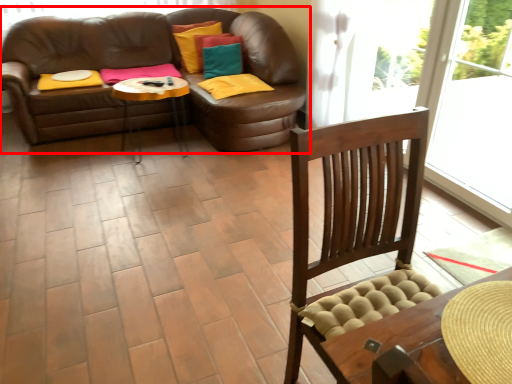
Question: From the image's perspective, what is the correct spatial positioning of studio couch (annotated by the red box) in reference to footrest?

Choices:
 (A) above
 (B) below

Answer: (A)